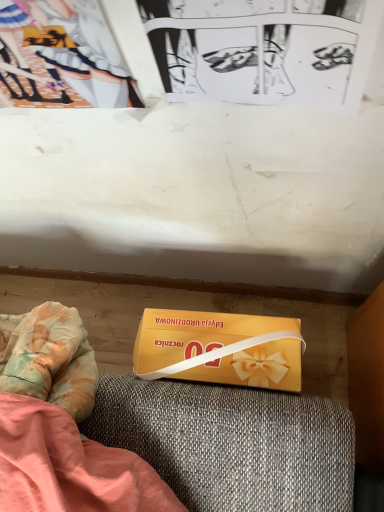
Question: Is the depth of black paper at upper center less than that of matte paper couple at upper left?

Choices:
 (A) no
 (B) yes

Answer: (B)

Question: Can you confirm if black paper at upper center is thinner than matte paper couple at upper left?

Choices:
 (A) yes
 (B) no

Answer: (A)

Question: Is matte paper couple at upper left completely or partially inside black paper at upper center?

Choices:
 (A) no
 (B) yes

Answer: (A)

Question: Is black paper at upper center aimed at matte paper couple at upper left?

Choices:
 (A) yes
 (B) no

Answer: (B)

Question: Considering the relative sizes of black paper at upper center and matte paper couple at upper left in the image provided, is black paper at upper center shorter than matte paper couple at upper left?

Choices:
 (A) yes
 (B) no

Answer: (B)

Question: Is black paper at upper center at the left side of matte paper couple at upper left?

Choices:
 (A) no
 (B) yes

Answer: (A)

Question: Is yellow matte box at lower center far from black paper at upper center?

Choices:
 (A) no
 (B) yes

Answer: (A)

Question: Can you confirm if yellow matte box at lower center is wider than black paper at upper center?

Choices:
 (A) yes
 (B) no

Answer: (A)

Question: Does yellow matte box at lower center have a lesser height compared to black paper at upper center?

Choices:
 (A) no
 (B) yes

Answer: (B)

Question: From a real-world perspective, is yellow matte box at lower center over black paper at upper center?

Choices:
 (A) no
 (B) yes

Answer: (A)

Question: Is yellow matte box at lower center positioned with its back to black paper at upper center?

Choices:
 (A) yes
 (B) no

Answer: (B)

Question: From the image's perspective, is yellow matte box at lower center over black paper at upper center?

Choices:
 (A) yes
 (B) no

Answer: (B)

Question: Is yellow matte box at lower center inside black paper at upper center?

Choices:
 (A) no
 (B) yes

Answer: (A)